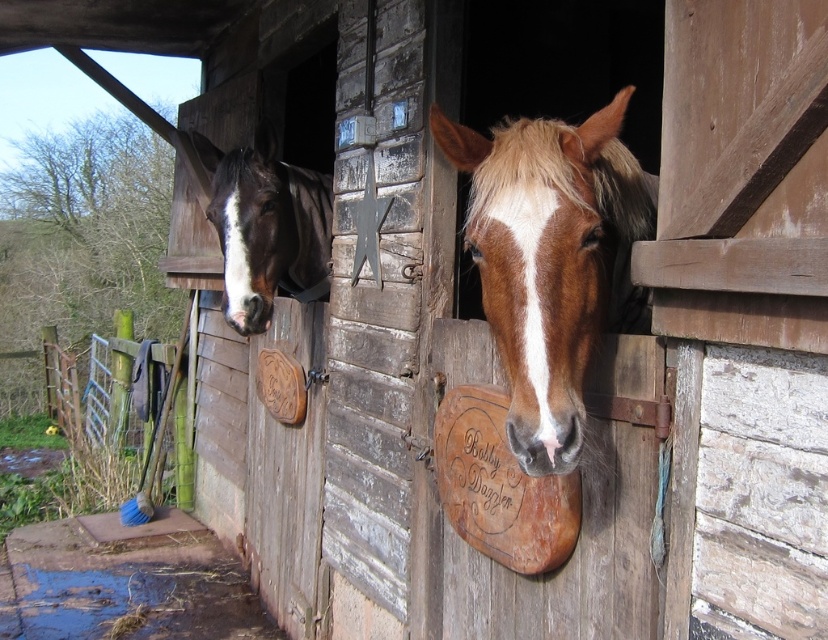
Question: Can you confirm if brown glossy horse at center is smaller than brown glossy horse at left?

Choices:
 (A) no
 (B) yes

Answer: (A)

Question: Is brown glossy horse at center closer to camera compared to brown glossy horse at left?

Choices:
 (A) no
 (B) yes

Answer: (B)

Question: Which point is farther to the camera?

Choices:
 (A) (310, 216)
 (B) (537, 424)

Answer: (A)

Question: From the image, what is the correct spatial relationship of brown glossy horse at center in relation to brown glossy horse at left?

Choices:
 (A) left
 (B) right

Answer: (B)

Question: Which object appears farthest from the camera in this image?

Choices:
 (A) brown glossy horse at left
 (B) brown glossy horse at center

Answer: (A)